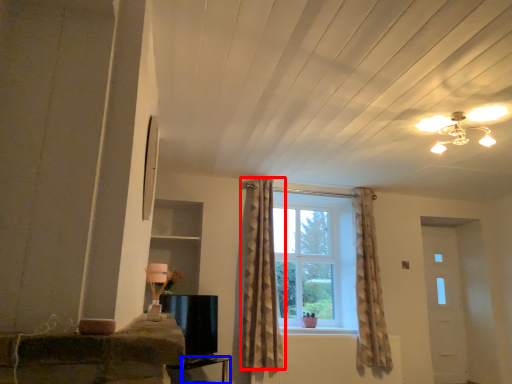
Question: Which of the following is the closest to the observer, curtain (highlighted by a red box) or table (highlighted by a blue box)?

Choices:
 (A) curtain
 (B) table

Answer: (B)